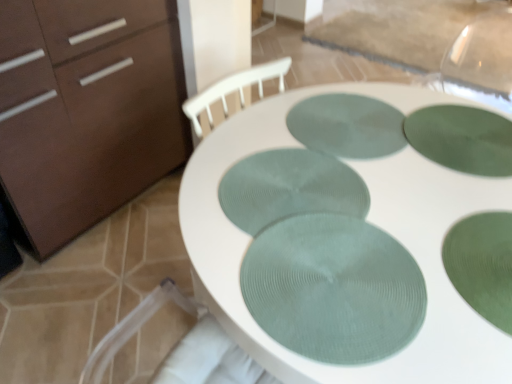
Identify the location of free space to the left of green textured placemat at center, which is the 1th glass plate in back-to-front order. The width and height of the screenshot is (512, 384). (249, 144).